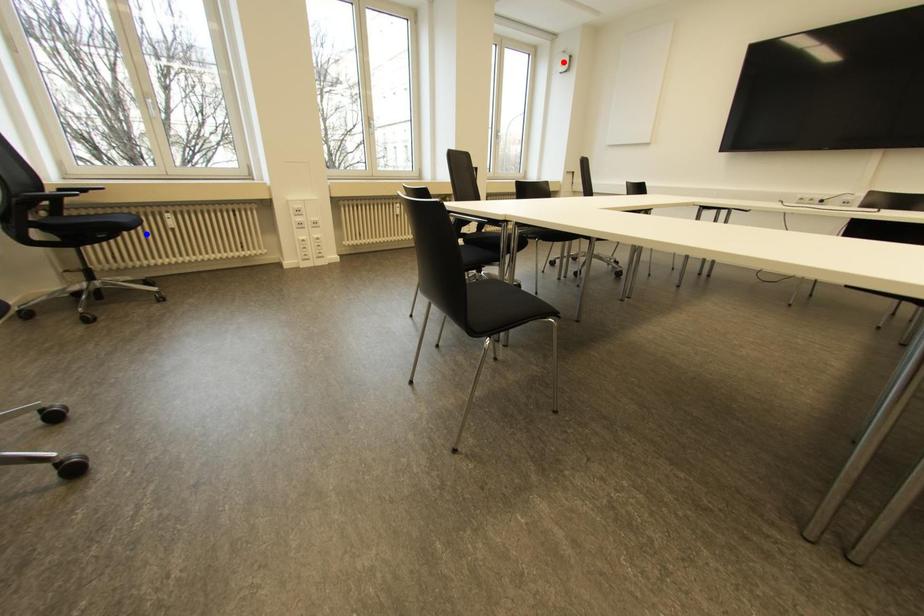
Question: Two points are marked on the image. Which point is closer to the camera?

Choices:
 (A) Blue point is closer.
 (B) Red point is closer.

Answer: (A)